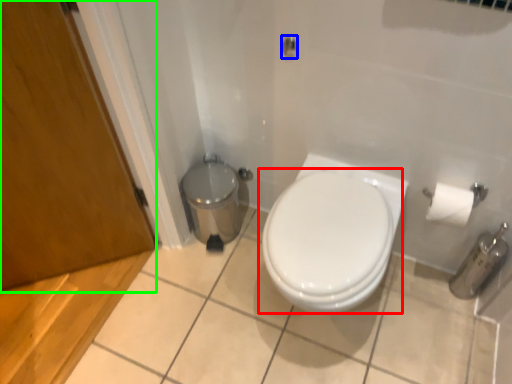
Question: Estimate the real-world distances between objects in this image. Which object is farther from toilet (highlighted by a red box), shower (highlighted by a blue box) or screen door (highlighted by a green box)?

Choices:
 (A) shower
 (B) screen door

Answer: (B)